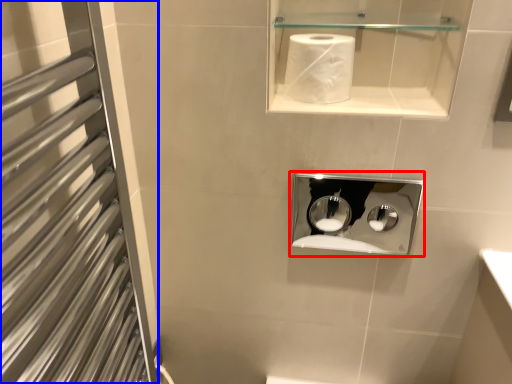
Question: Which object is further to the camera taking this photo, medicine cabinet (highlighted by a red box) or screen door (highlighted by a blue box)?

Choices:
 (A) medicine cabinet
 (B) screen door

Answer: (A)